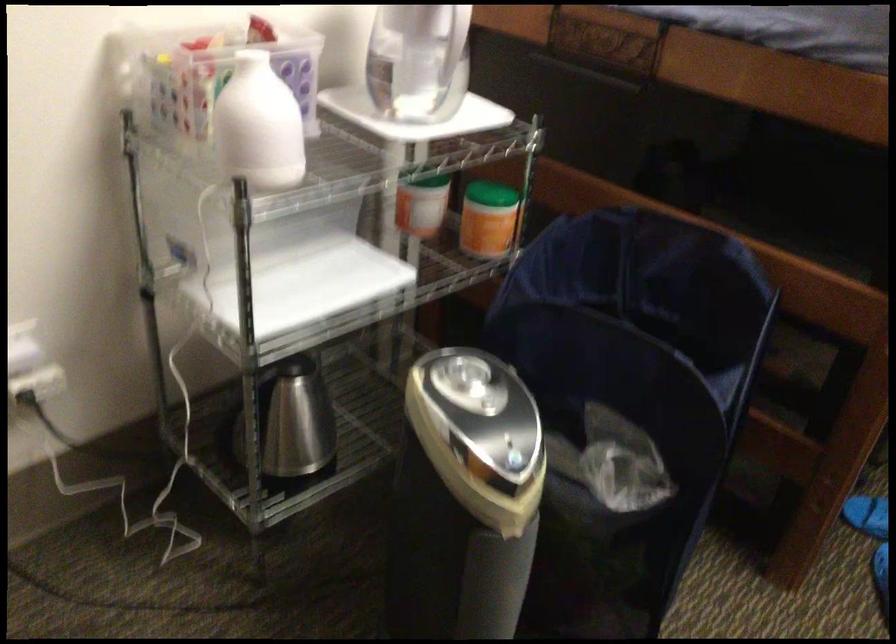
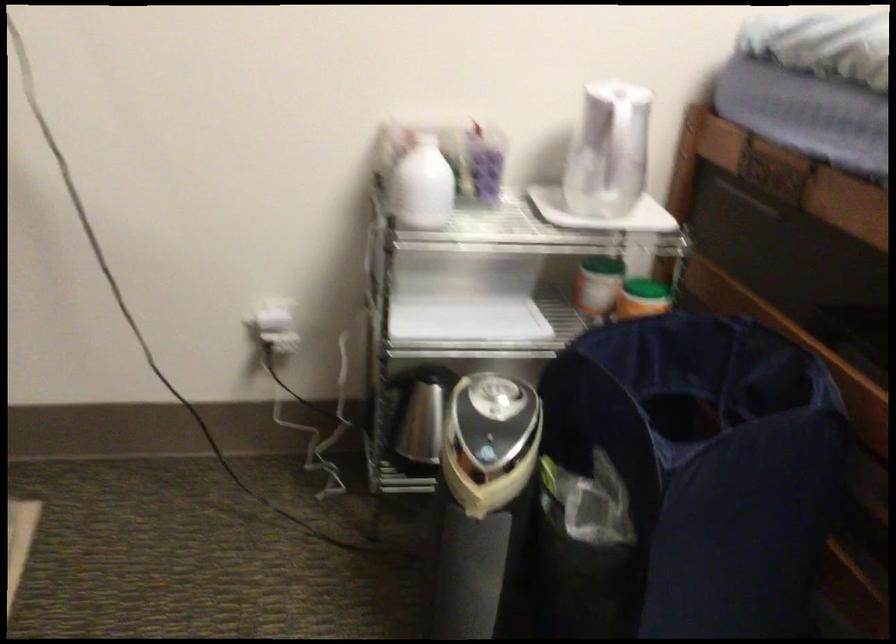
Where in the second image is the point corresponding to point 277,131 from the first image?

(421, 185)